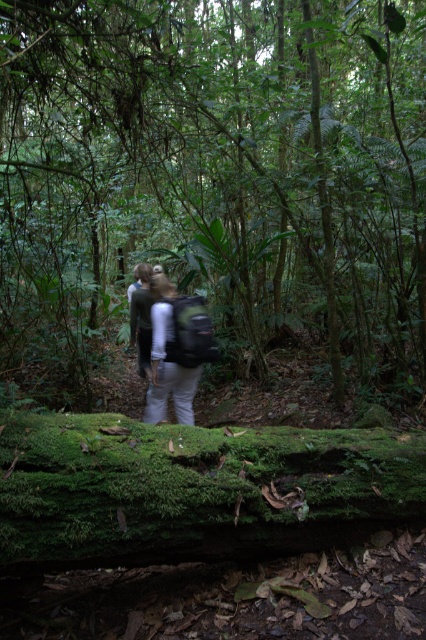
Does green mossy log at lower center come in front of light gray fabric backpack at center?

Yes, green mossy log at lower center is closer to the viewer.

Between green mossy log at lower center and light gray fabric backpack at center, which one is positioned higher?

green mossy log at lower center is above.

This screenshot has width=426, height=640. Find the location of `green mossy log at lower center`. green mossy log at lower center is located at coordinates (215, 179).